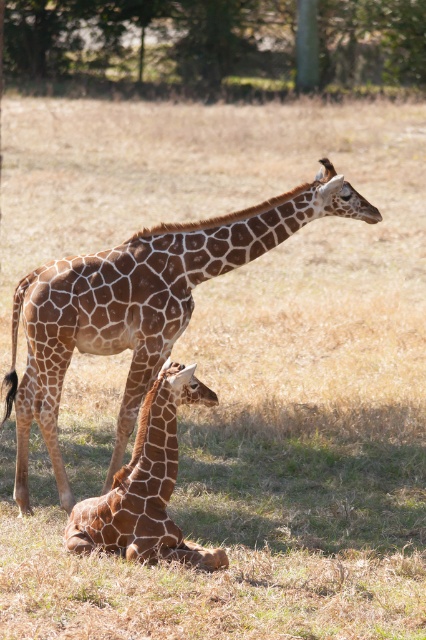
Question: Can you confirm if brown spotted giraffe at center is positioned below brown spotted giraffe at lower center?

Choices:
 (A) no
 (B) yes

Answer: (A)

Question: Which point appears closest to the camera in this image?

Choices:
 (A) (310, 40)
 (B) (157, 444)

Answer: (B)

Question: Which of the following is the farthest from the observer?

Choices:
 (A) brown spotted giraffe at lower center
 (B) brown spotted giraffe at center
 (C) green leafy tree at upper center

Answer: (C)

Question: Is brown spotted giraffe at center positioned in front of brown spotted giraffe at lower center?

Choices:
 (A) yes
 (B) no

Answer: (B)

Question: Among these points, which one is nearest to the camera?

Choices:
 (A) (281, 205)
 (B) (173, 385)

Answer: (B)

Question: Is green leafy tree at upper center bigger than brown spotted giraffe at center?

Choices:
 (A) no
 (B) yes

Answer: (B)